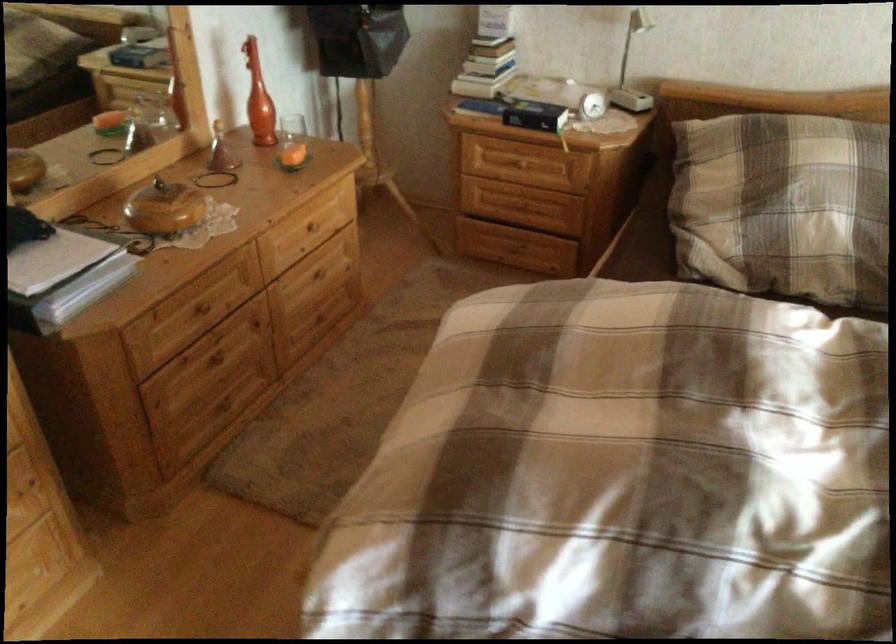
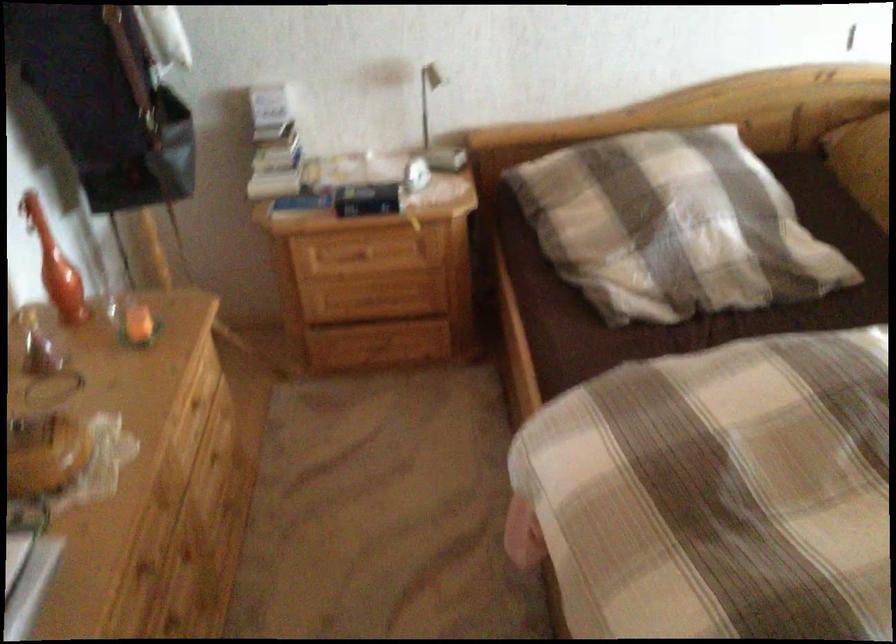
In the second image, find the point that corresponds to pixel 203 305 in the first image.

(144, 565)